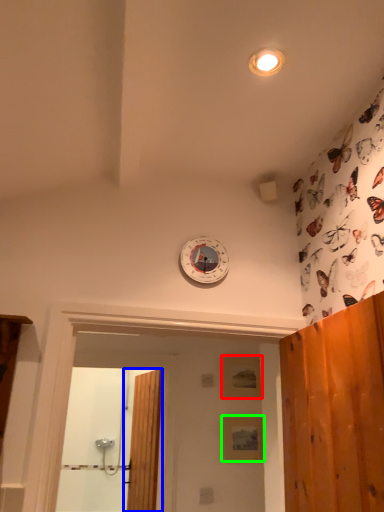
Question: Which object is positioned closest to panel (highlighted by a red box)? Select from door (highlighted by a blue box) and panel (highlighted by a green box).

Choices:
 (A) door
 (B) panel

Answer: (B)